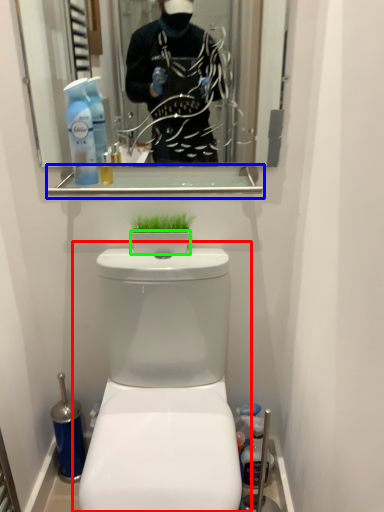
Question: Considering the real-world distances, which object is closest to toilet (highlighted by a red box)? balustrade (highlighted by a blue box) or toilet bowl (highlighted by a green box).

Choices:
 (A) balustrade
 (B) toilet bowl

Answer: (B)